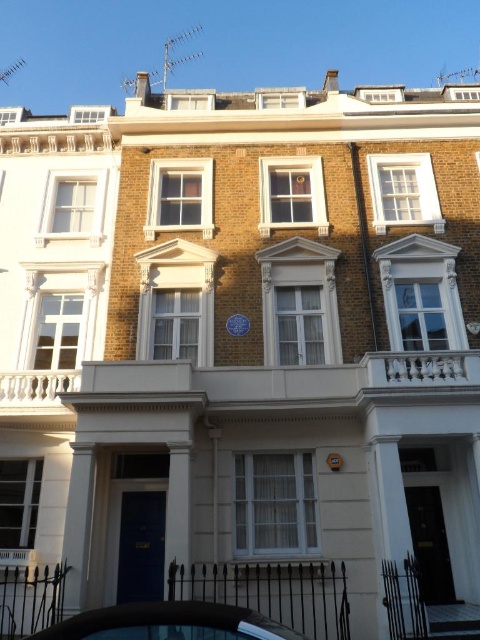
Question: Is shiny black car at lower center smaller than yellow plastic clock at center?

Choices:
 (A) yes
 (B) no

Answer: (B)

Question: Which point is closer to the camera?

Choices:
 (A) shiny black car at lower center
 (B) yellow plastic clock at center

Answer: (A)

Question: Is shiny black car at lower center above yellow plastic clock at center?

Choices:
 (A) no
 (B) yes

Answer: (B)

Question: Does shiny black car at lower center lie in front of yellow plastic clock at center?

Choices:
 (A) no
 (B) yes

Answer: (B)